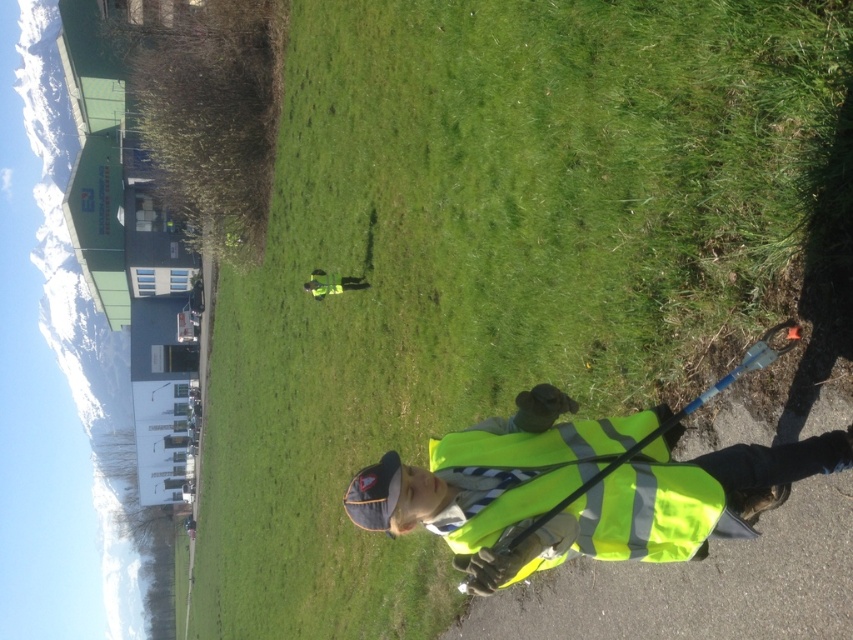
Question: Which point is farther to the camera?

Choices:
 (A) high-visibility fabric safety vest at center
 (B) high-visibility yellow vest at center

Answer: (A)

Question: Does high-visibility fabric safety vest at center have a lesser width compared to yellow reflective vest at center?

Choices:
 (A) no
 (B) yes

Answer: (A)

Question: Does high-visibility yellow vest at center come behind high-visibility fabric safety vest at center?

Choices:
 (A) no
 (B) yes

Answer: (A)

Question: Is high-visibility fabric safety vest at center further to the viewer compared to yellow reflective vest at center?

Choices:
 (A) yes
 (B) no

Answer: (B)

Question: Which point is farther from the camera taking this photo?

Choices:
 (A) (625, 493)
 (B) (666, 557)

Answer: (B)

Question: Which point is closer to the camera taking this photo?

Choices:
 (A) (326, 289)
 (B) (500, 490)
 (C) (558, 481)

Answer: (C)